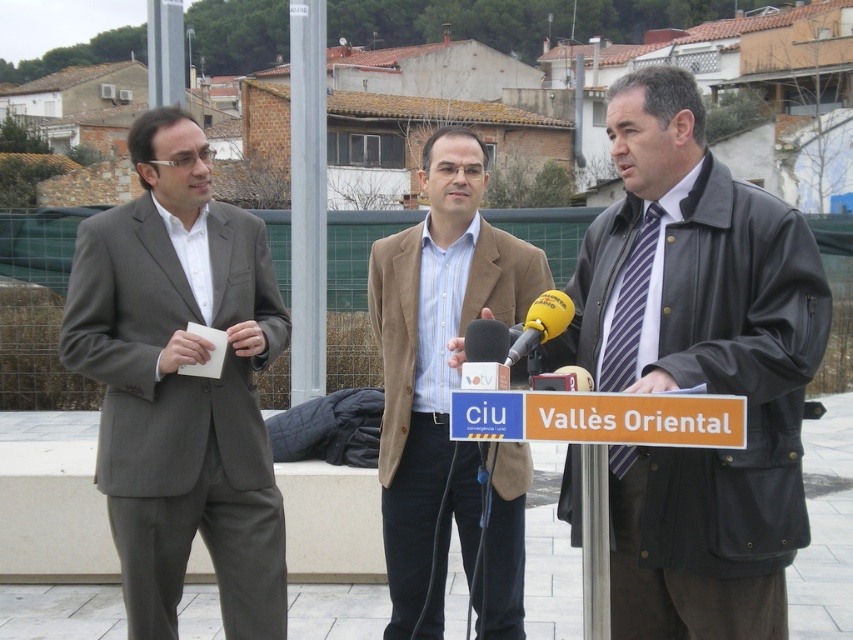
Question: Can you confirm if leather jacket at center is wider than yellow foam microphone at center?

Choices:
 (A) no
 (B) yes

Answer: (B)

Question: Which object is farther from the camera taking this photo?

Choices:
 (A) metallic pole at center
 (B) matte gray suit at left
 (C) leather jacket at center
 (D) yellow foam microphone at center

Answer: (A)

Question: Estimate the real-world distances between objects in this image. Which object is closer to the metallic pole at center?

Choices:
 (A) yellow foam microphone at center
 (B) matte gray suit at left
 (C) leather jacket at center

Answer: (B)

Question: Is leather jacket at center below yellow foam microphone at center?

Choices:
 (A) no
 (B) yes

Answer: (B)

Question: Is matte gray suit at left thinner than brown textured blazer at center?

Choices:
 (A) yes
 (B) no

Answer: (B)

Question: Which point is closer to the camera?

Choices:
 (A) leather jacket at center
 (B) matte gray suit at left
 (C) brown textured blazer at center

Answer: (A)